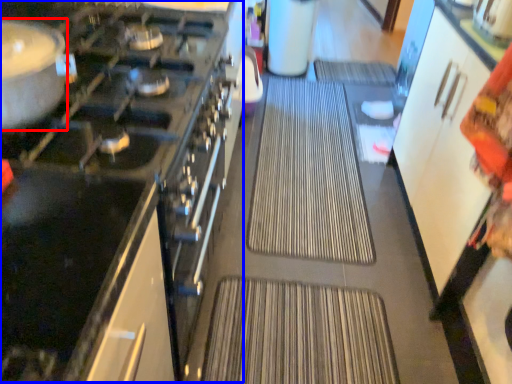
Question: Which of the following is the closest to the observer, kitchen appliance (highlighted by a red box) or appliance (highlighted by a blue box)?

Choices:
 (A) kitchen appliance
 (B) appliance

Answer: (A)